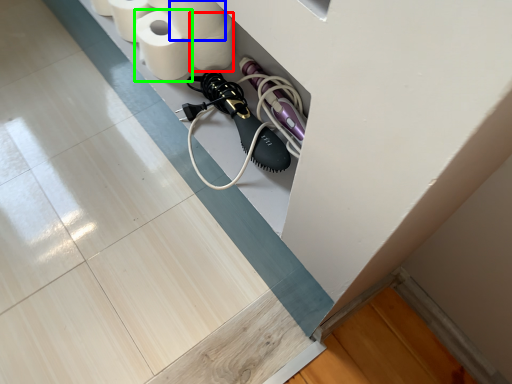
Question: Which object is the farthest from toilet paper (highlighted by a red box)? Choose among these: toilet paper (highlighted by a blue box) or toilet paper (highlighted by a green box).

Choices:
 (A) toilet paper
 (B) toilet paper

Answer: (B)